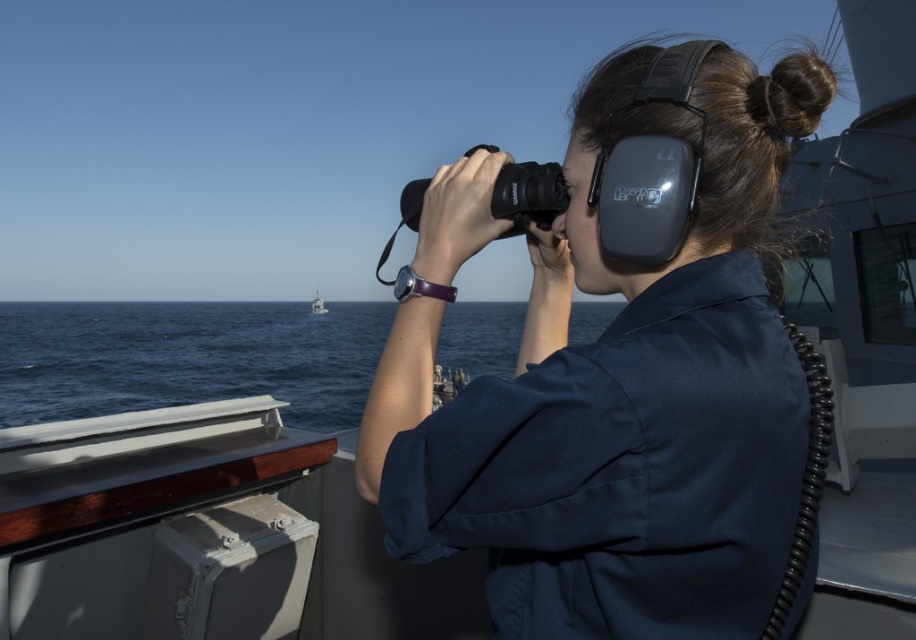
Question: Among these objects, which one is nearest to the camera?

Choices:
 (A) blue water at lower left
 (B) white plastic boat at center

Answer: (A)

Question: In this image, where is matte black binoculars at center located relative to white plastic boat at center?

Choices:
 (A) right
 (B) left

Answer: (A)

Question: Which object is the closest to the blue water at lower left?

Choices:
 (A) white plastic boat at center
 (B) matte black binoculars at center

Answer: (B)

Question: Is blue water at lower left smaller than white plastic boat at center?

Choices:
 (A) yes
 (B) no

Answer: (B)

Question: Which object is positioned closest to the white plastic boat at center?

Choices:
 (A) blue water at lower left
 (B) matte black binoculars at center

Answer: (A)

Question: Can you confirm if blue water at lower left is wider than white plastic boat at center?

Choices:
 (A) no
 (B) yes

Answer: (B)